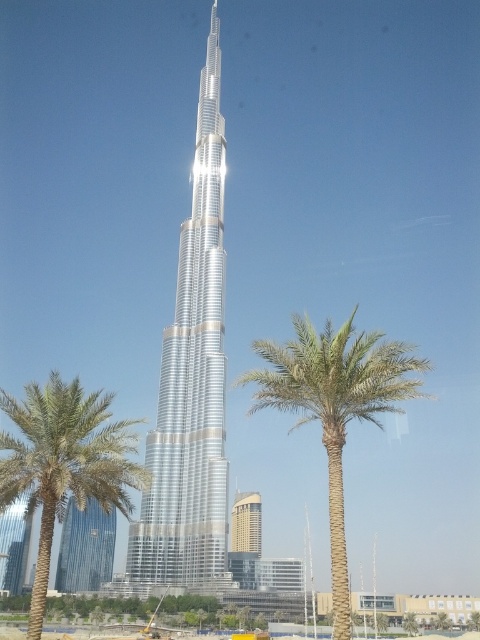
You are standing in front of the Burj Khalifa and want to take a photo that includes both the point at coordinates point (288,380) and point (40,592). Which point is closer to your camera when taking the photo?

Point (40,592) is closer to the camera than point (288,380) because the description states that point (288,380) is further to the camera than point (40,592).

Based on the photo, you are an architect evaluating the Burj Khalifa site. You see the silver metallic tower at center and the green leafy palm at center. Which object is taller?

The silver metallic tower at center is taller than the green leafy palm at center.